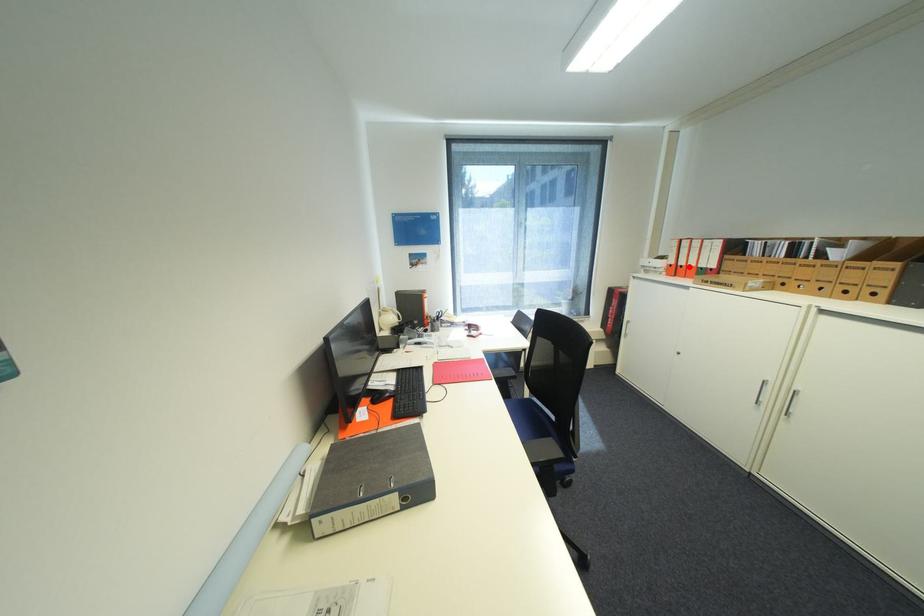
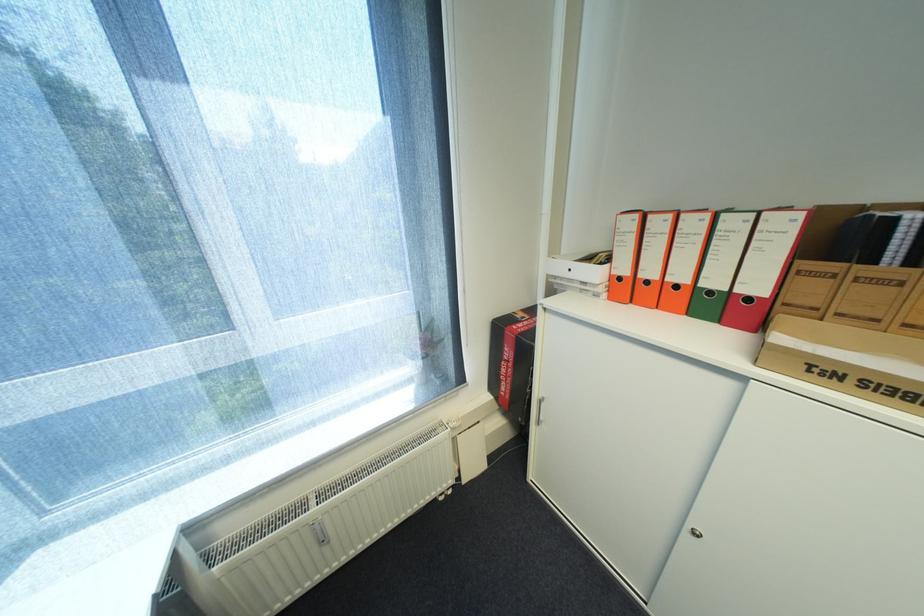
In the second image, find the point that corresponds to the highlighted location in the first image.

(655, 283)